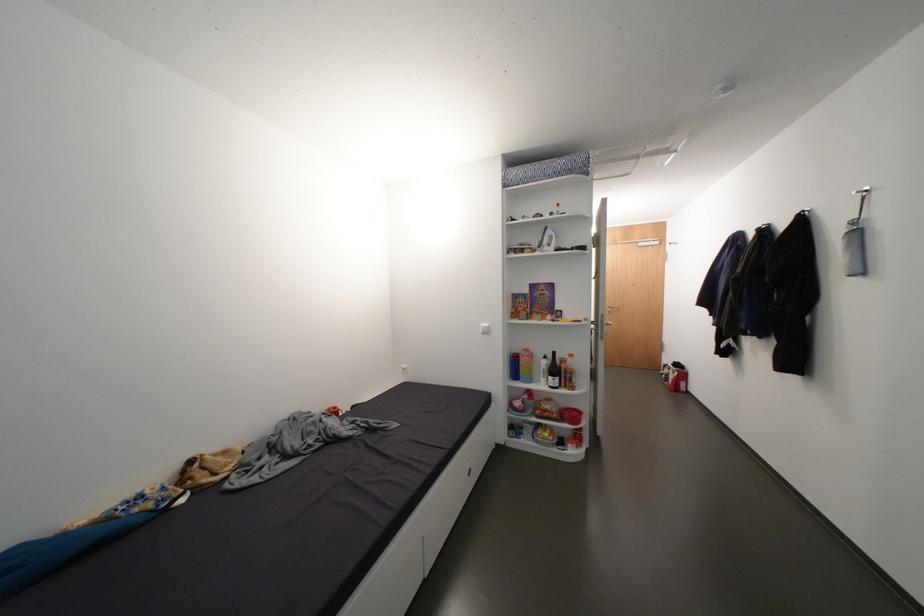
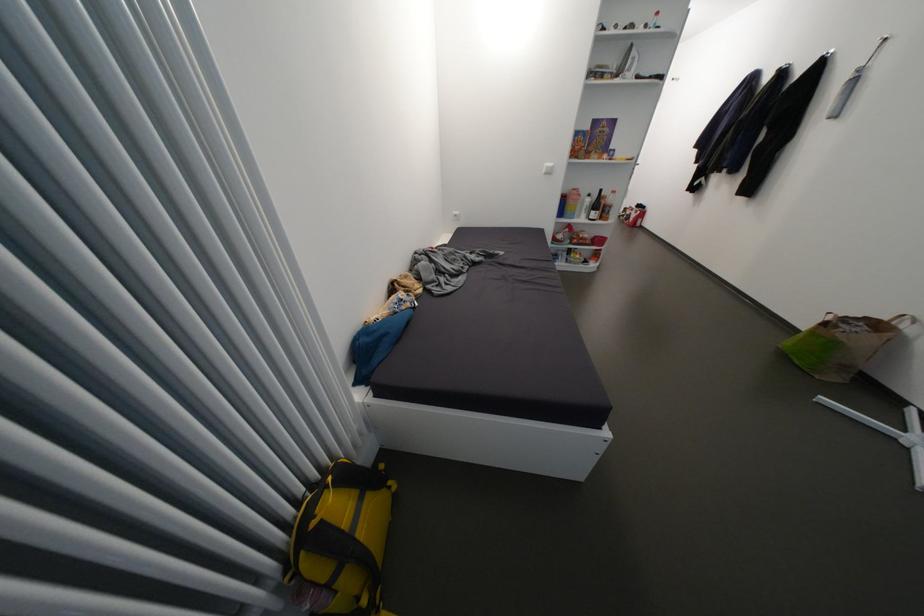
Where in the second image is the point corresponding to pixel 681 373 from the first image?

(642, 214)